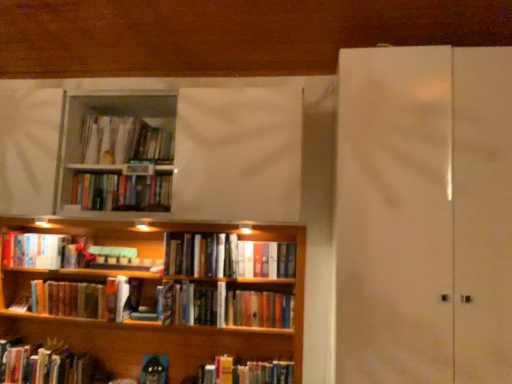
Question: Can you confirm if wooden bookcase at lower left is wider than hardcover book at lower left, which ranks as the 6th book in top-to-bottom order?

Choices:
 (A) yes
 (B) no

Answer: (A)

Question: From the image's perspective, is wooden bookcase at lower left beneath hardcover book at lower left, which ranks as the 6th book in top-to-bottom order?

Choices:
 (A) no
 (B) yes

Answer: (B)

Question: Is wooden bookcase at lower left completely or partially outside of hardcover book at lower left, which ranks as the 6th book in top-to-bottom order?

Choices:
 (A) no
 (B) yes

Answer: (B)

Question: Is wooden bookcase at lower left bigger than hardcover book at lower left, which is the second book in bottom-to-top order?

Choices:
 (A) yes
 (B) no

Answer: (A)

Question: Is wooden bookcase at lower left at the right side of hardcover book at lower left, which is the second book in bottom-to-top order?

Choices:
 (A) yes
 (B) no

Answer: (A)

Question: Looking at their shapes, would you say hardcover books at center, positioned as the 3th book in bottom-to-top order, is wider or thinner than white glossy screen door at right?

Choices:
 (A) thin
 (B) wide

Answer: (A)

Question: From the image's perspective, is hardcover books at center, positioned as the 3th book in bottom-to-top order, located above or below white glossy screen door at right?

Choices:
 (A) above
 (B) below

Answer: (B)

Question: In the image, is hardcover books at center, the 5th book when ordered from top to bottom, positioned in front of or behind white glossy screen door at right?

Choices:
 (A) front
 (B) behind

Answer: (B)

Question: Is point (265, 274) positioned closer to the camera than point (344, 340)?

Choices:
 (A) closer
 (B) farther

Answer: (B)

Question: From a real-world perspective, relative to hardcover books at center, positioned as the 3th book in bottom-to-top order, is hardcover books at center, which is the fourth book from top to bottom, vertically above or below?

Choices:
 (A) above
 (B) below

Answer: (A)

Question: Which is correct: hardcover books at center, which is the fourth book from top to bottom, is inside hardcover books at center, the 5th book when ordered from top to bottom, or outside of it?

Choices:
 (A) outside
 (B) inside

Answer: (A)

Question: In terms of height, does hardcover books at center, which is the fourth book from top to bottom, look taller or shorter compared to hardcover books at center, the 5th book when ordered from top to bottom?

Choices:
 (A) tall
 (B) short

Answer: (A)

Question: From the image's perspective, is hardcover books at center, which is the fourth book from top to bottom, located above or below hardcover books at center, the 5th book when ordered from top to bottom?

Choices:
 (A) below
 (B) above

Answer: (B)

Question: Is hardcover book at left, positioned as the third book in top-to-bottom order, wider or thinner than white glossy screen door at right?

Choices:
 (A) thin
 (B) wide

Answer: (A)

Question: Visually, is hardcover book at left, positioned as the fifth book in bottom-to-top order, positioned to the left or to the right of white glossy screen door at right?

Choices:
 (A) right
 (B) left

Answer: (B)